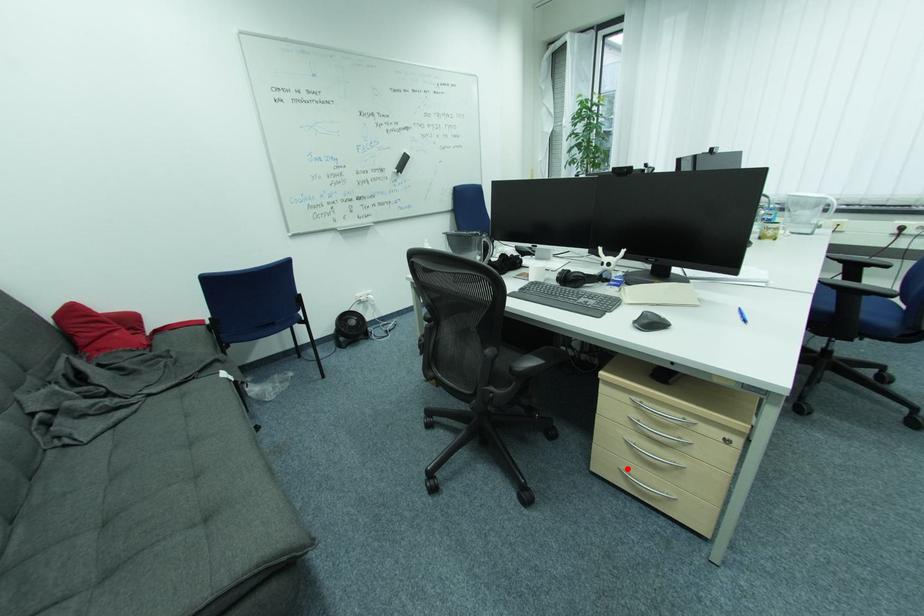
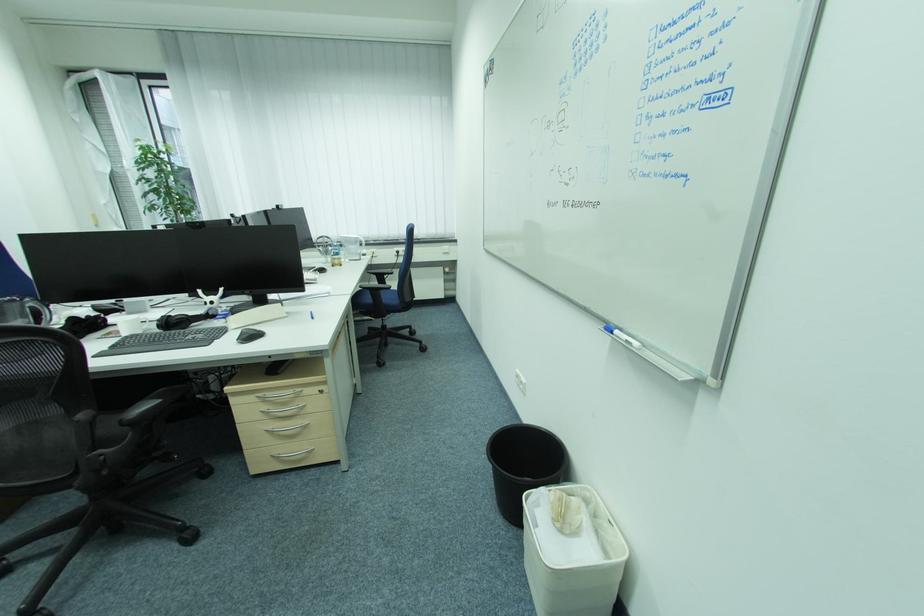
Question: I am providing you with two images of the same scene from different viewpoints. In image1, a red point is highlighted. Considering the same 3D point in image2, which of the following is correct?

Choices:
 (A) It is closer
 (B) It is farther

Answer: (A)